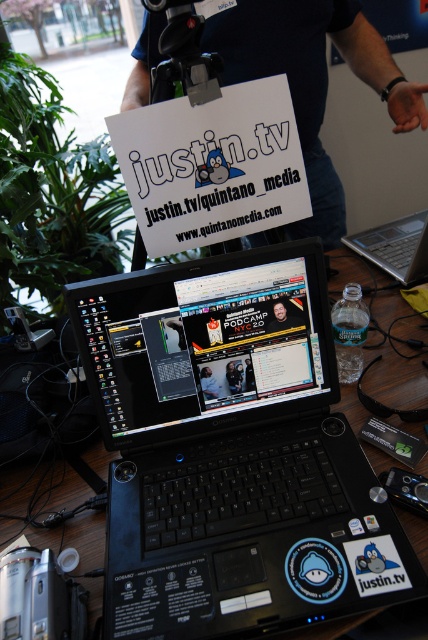
You are setting up for an event and need to access both the black plastic laptop at center and the silver metallic laptop at center. Which one do you need to move first to reach the other?

The black plastic laptop at center is in front of the silver metallic laptop at center, so you would need to move the black plastic laptop at center first to access the silver metallic laptop at center.

You are a photographer setting up for a product shoot. You need to place a 12 inch ruler between the blue shirt at upper center and the silver metallic laptop at center. Based on the scene description, will the ruler fit perfectly between them without overlapping either object?

The distance between the blue shirt at upper center and the silver metallic laptop at center is 11.80 inches. Since the ruler is 12 inches long, it will extend slightly beyond the space between them, causing overlap with both objects.

You are attending a tech conference and see the blue shirt at upper center and the silver metallic laptop at center in the image. Which object takes up more space in the image?

The blue shirt at upper center is bigger than the silver metallic laptop at center, so it takes up more space in the image.